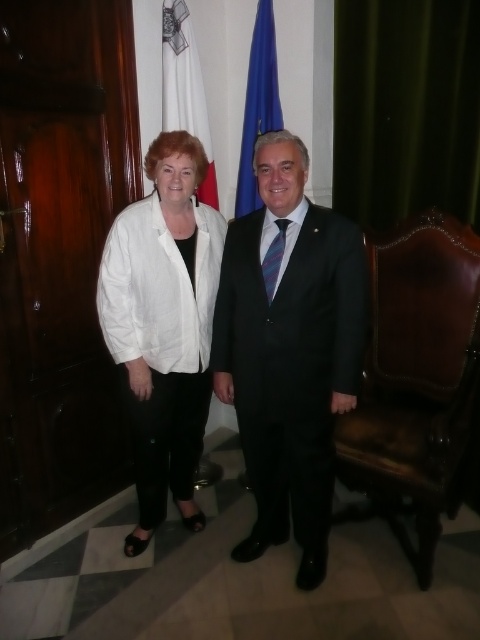
You are a delivery robot with a package that requires a 1.2 meter path to maneuver safely. You need to move from the brown leather armchair at right to the white fabric flag at upper left. Is the path between them wide enough for your delivery?

The distance between the brown leather armchair at right and the white fabric flag at upper left is 1.08 meters, which is narrower than the required 1.2 meters. Therefore, the path is not wide enough for safe maneuvering.

You are a photographer setting up for a photo shoot. You need to ensure that the white cotton blouse at center is visible above the blue fabric flag at upper center. Based on the scene description, is this possible?

The white cotton blouse at center is positioned under the blue fabric flag at upper center, so it cannot be visible above the flag.

You are a tailor measuring the distance between two white items in the scene. The items are the white cotton blouse at center and the white fabric flag at upper left. The tailor needs to know if the distance between them is more than 24 inches to ensure proper spacing for a display. Is the distance sufficient?

The distance between the white cotton blouse at center and the white fabric flag at upper left is 24.98 inches, which is just over 24 inches. Therefore, the spacing is sufficient for the display.